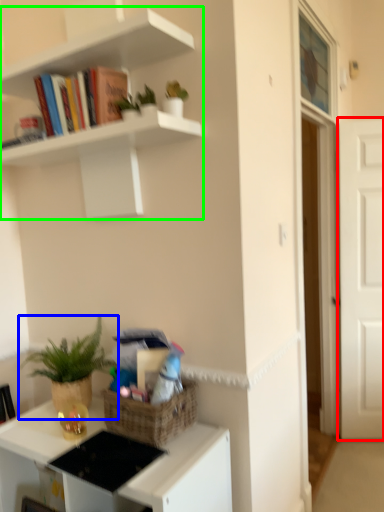
Question: Considering the real-world distances, which object is farthest from door (highlighted by a red box)? houseplant (highlighted by a blue box) or shelf (highlighted by a green box)?

Choices:
 (A) houseplant
 (B) shelf

Answer: (A)